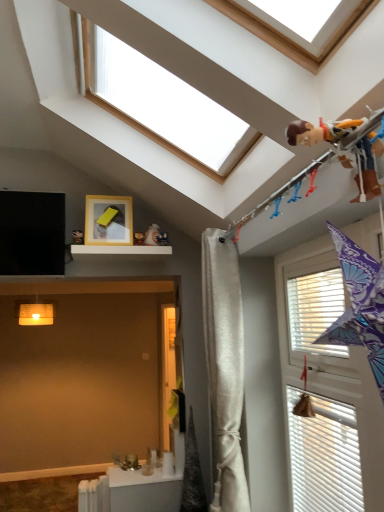
Question: Is white metallic radiator at lower left oriented away from white matte shelf at upper center?

Choices:
 (A) no
 (B) yes

Answer: (A)

Question: Is white metallic radiator at lower left not within white matte shelf at upper center?

Choices:
 (A) no
 (B) yes

Answer: (B)

Question: Is white metallic radiator at lower left positioned behind white matte shelf at upper center?

Choices:
 (A) yes
 (B) no

Answer: (A)

Question: Can you confirm if white metallic radiator at lower left is taller than white matte shelf at upper center?

Choices:
 (A) no
 (B) yes

Answer: (B)

Question: Is white metallic radiator at lower left not close to white matte shelf at upper center?

Choices:
 (A) yes
 (B) no

Answer: (A)

Question: Is white metallic radiator at lower left bigger than white matte shelf at upper center?

Choices:
 (A) yes
 (B) no

Answer: (B)

Question: Considering the relative sizes of brown fabric toy at upper right and white matte shelf at upper center in the image provided, is brown fabric toy at upper right wider than white matte shelf at upper center?

Choices:
 (A) no
 (B) yes

Answer: (A)

Question: Does brown fabric toy at upper right have a lesser width compared to white matte shelf at upper center?

Choices:
 (A) yes
 (B) no

Answer: (A)

Question: Is there a large distance between brown fabric toy at upper right and white matte shelf at upper center?

Choices:
 (A) yes
 (B) no

Answer: (A)

Question: Is brown fabric toy at upper right positioned with its back to white matte shelf at upper center?

Choices:
 (A) yes
 (B) no

Answer: (B)

Question: From the image's perspective, is brown fabric toy at upper right over white matte shelf at upper center?

Choices:
 (A) yes
 (B) no

Answer: (A)

Question: From the image's perspective, would you say brown fabric toy at upper right is shown under white matte shelf at upper center?

Choices:
 (A) no
 (B) yes

Answer: (A)

Question: Is white textured window at right, arranged as the 1th window when viewed from the right, surrounding white metallic radiator at lower left?

Choices:
 (A) no
 (B) yes

Answer: (A)